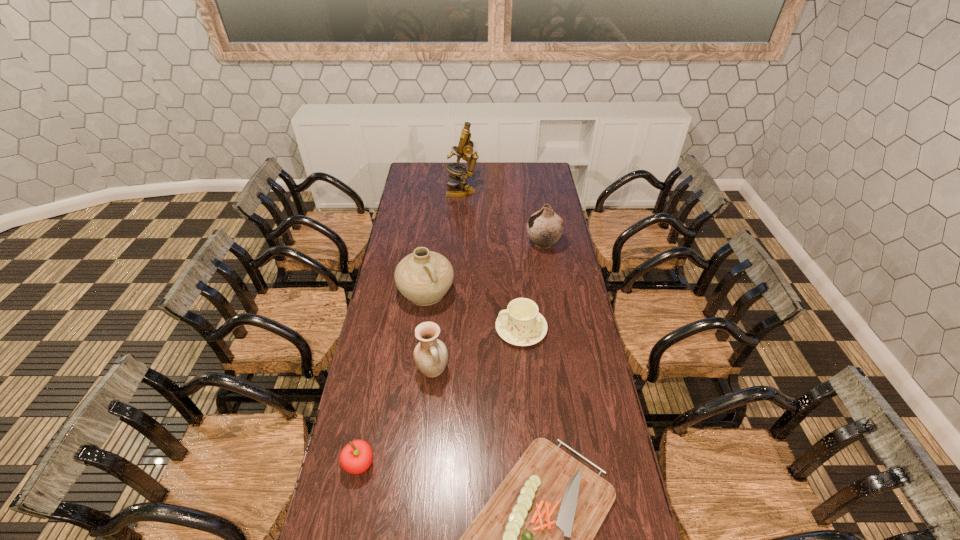
Where is `object located in the right edge section of the desktop`? The width and height of the screenshot is (960, 540). object located in the right edge section of the desktop is located at coordinates (544, 227).

I want to click on free space at the far edge of the desktop, so click(492, 174).

The height and width of the screenshot is (540, 960). In the image, there is a desktop. Find the location of `vacant space at the left edge`. vacant space at the left edge is located at coordinates (422, 206).

Locate an element on the screen. This screenshot has width=960, height=540. vacant area at the right edge is located at coordinates [573, 254].

Locate an element on the screen. free space at the far left corner of the desktop is located at coordinates (414, 170).

You are a GUI agent. You are given a task and a screenshot of the screen. Output one action in this format:
    pyautogui.click(x=<x>, y=<y>)
    Task: Click on the unoccupied area between the apple and the fifth farthest object
    
    Given the screenshot: What is the action you would take?
    pyautogui.click(x=396, y=417)

Where is `blank region between the second nearest pottery and the apple`? The image size is (960, 540). blank region between the second nearest pottery and the apple is located at coordinates (393, 379).

The width and height of the screenshot is (960, 540). I want to click on free space between the nearest pottery and the second farthest object, so click(x=488, y=307).

Identify the location of free area in between the second farthest pottery and the second farthest object. This screenshot has width=960, height=540. (485, 269).

The image size is (960, 540). In order to click on empty space between the second farthest pottery and the farthest pottery in this screenshot , I will do `click(485, 269)`.